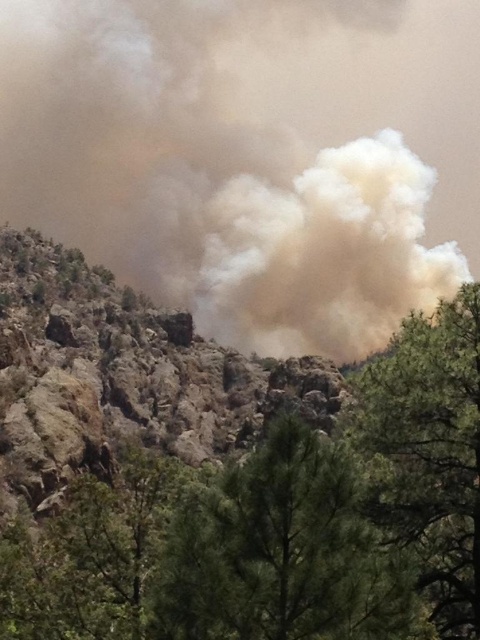
Question: Can you confirm if rugged rock cliff at center is wider than green textured tree at lower center?

Choices:
 (A) yes
 (B) no

Answer: (A)

Question: Observing the image, what is the correct spatial positioning of rugged rock cliff at center in reference to green textured tree at lower center?

Choices:
 (A) below
 (B) above

Answer: (B)

Question: Can you confirm if rugged rock cliff at center is wider than green textured tree at center?

Choices:
 (A) no
 (B) yes

Answer: (B)

Question: Which of the following is the farthest from the observer?

Choices:
 (A) green textured tree at center
 (B) brown dusty cloud at center
 (C) green textured tree at lower center

Answer: (B)

Question: Which object is the closest to the green textured tree at lower center?

Choices:
 (A) rugged rock cliff at center
 (B) green textured tree at center

Answer: (B)

Question: Which of the following is the closest to the observer?

Choices:
 (A) rugged rock cliff at center
 (B) green textured tree at lower center
 (C) green textured tree at center

Answer: (B)